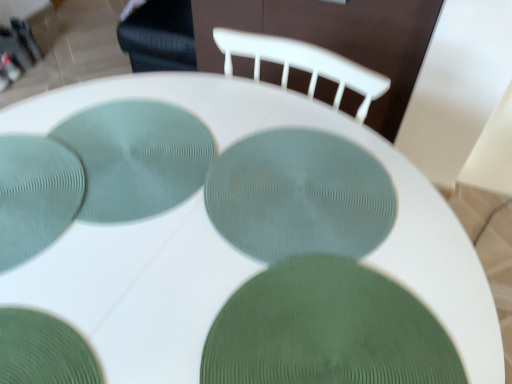
This screenshot has height=384, width=512. I want to click on vacant area that is situated to the right of matte green plate at lower left, which is the first glass plate in left-to-right order, so click(x=155, y=217).